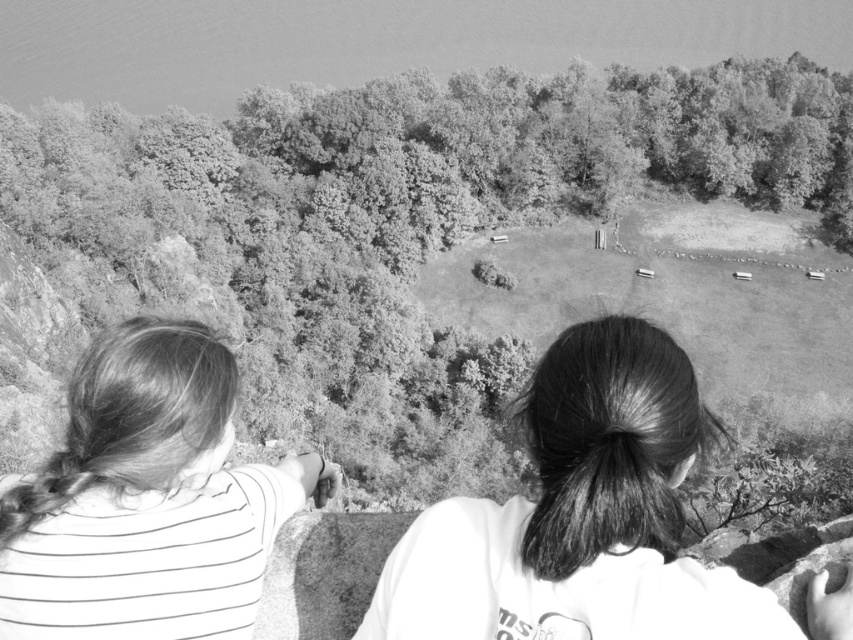
Question: Is white t-shirt at center positioned in front of striped fabric hair at left?

Choices:
 (A) yes
 (B) no

Answer: (A)

Question: Which object is closer to the camera taking this photo?

Choices:
 (A) smooth green tree at center
 (B) striped fabric hair at left
 (C) white t-shirt at center

Answer: (C)

Question: Is smooth green tree at center further to camera compared to white t-shirt at center?

Choices:
 (A) yes
 (B) no

Answer: (A)

Question: Which of the following is the farthest from the observer?

Choices:
 (A) striped fabric hair at left
 (B) smooth green tree at center

Answer: (B)

Question: Which object is farther from the camera taking this photo?

Choices:
 (A) white t-shirt at center
 (B) smooth green tree at center
 (C) striped fabric hair at left

Answer: (B)

Question: Is smooth green tree at center to the left of striped fabric hair at left from the viewer's perspective?

Choices:
 (A) yes
 (B) no

Answer: (B)